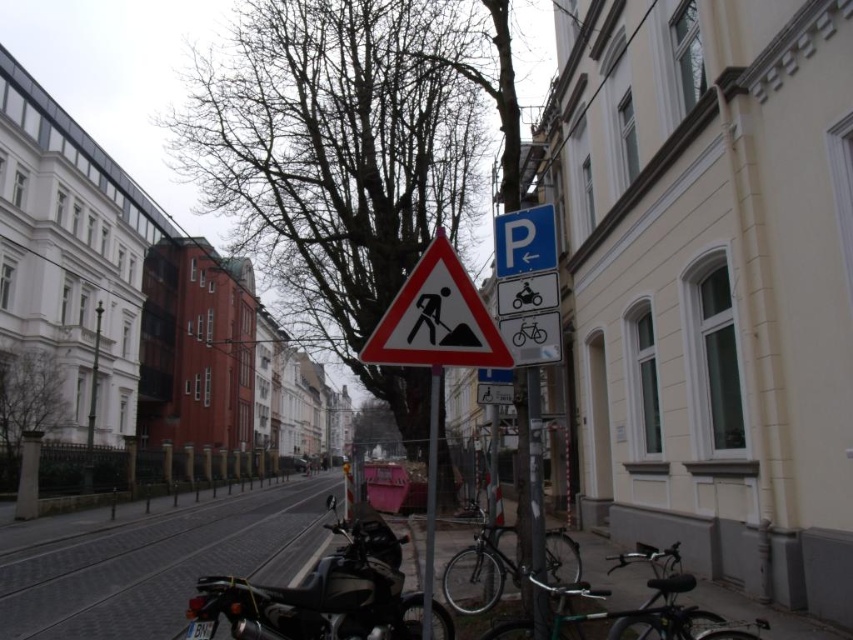
You are a pedestrian trying to read the blue plastic parking sign at upper center. Is the bare branches at center blocking your view of the sign?

Yes, the bare branches at center is positioned over the blue plastic parking sign at upper center, so it is blocking the view of the sign.

You are standing at the intersection and see the point marked at coordinates [337,160]. What is located at that point?

The point at coordinates [337,160] marks the location of bare branches at center.

You are a delivery driver navigating through the urban street scene. You see two points marked as point 1 and point 2. Point 1 is at coordinate point (15, 566) and point 2 is at coordinate point (645, 604). Which point is closer to you as you drive along the street?

Point 2 at coordinate point (645, 604) is closer to you because it is in front of point 1 at coordinate point (15, 566).